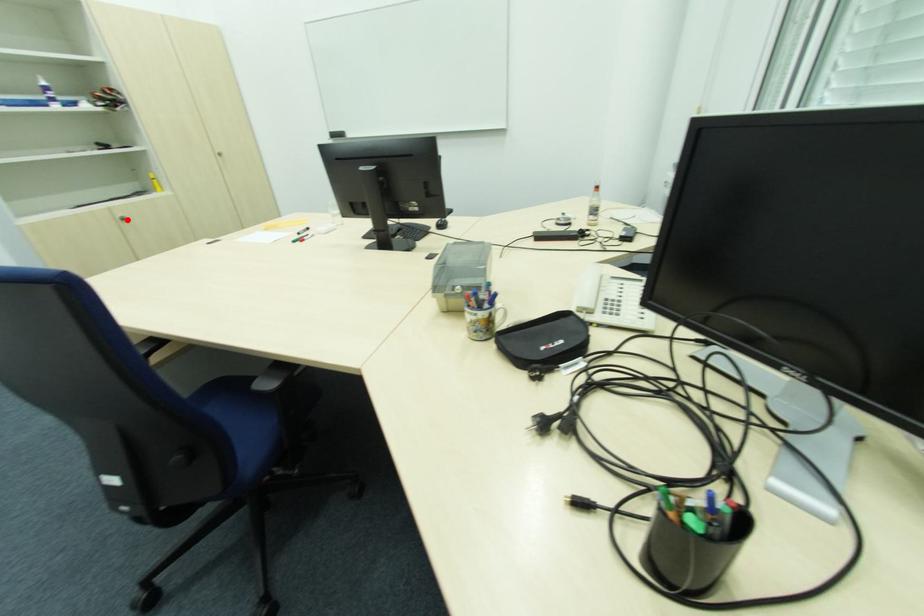
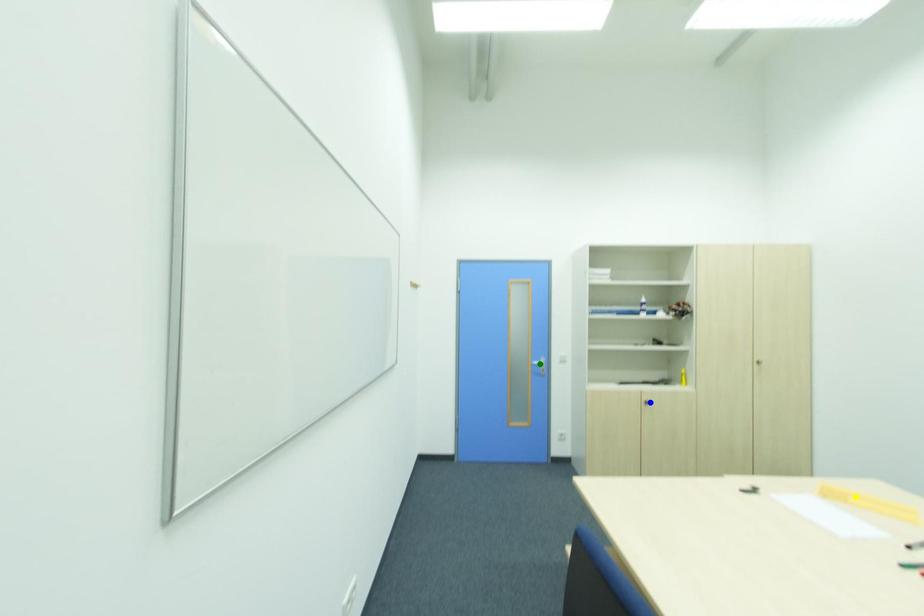
Question: I am providing you with two images of the same scene from different viewpoints. A red point is marked on the first image. You are given multiple points on the second image. Which spot in image 2 lines up with the point in image 1?

Choices:
 (A) blue point
 (B) green point
 (C) yellow point

Answer: (A)